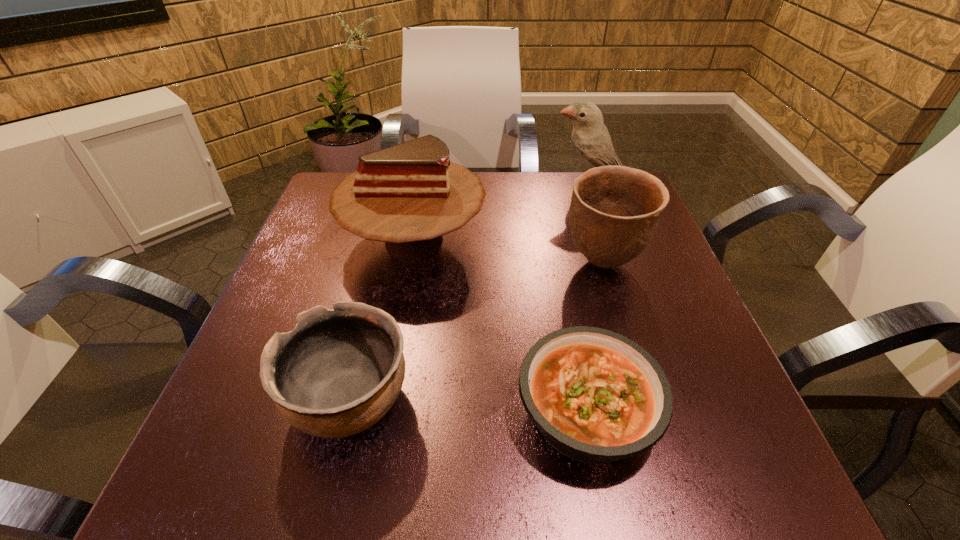
The image size is (960, 540). I want to click on the farthest object, so [591, 141].

At what (x,y) coordinates should I click in order to perform the action: click on cake. Please return your answer as a coordinate pair (x, y). The width and height of the screenshot is (960, 540). Looking at the image, I should click on (408, 195).

I want to click on the farther pottery, so click(x=614, y=212).

Find the location of a particular element. The width and height of the screenshot is (960, 540). the taller pottery is located at coordinates (614, 212).

Identify the location of the shorter pottery. (339, 371).

Find the location of a particular element. The image size is (960, 540). the nearer pottery is located at coordinates (339, 371).

Identify the location of the shortest object. This screenshot has width=960, height=540. (596, 396).

The height and width of the screenshot is (540, 960). I want to click on vacant space positioned at the face of the bird, so click(432, 185).

This screenshot has height=540, width=960. I want to click on free space located at the face of the bird, so click(x=428, y=185).

You are a GUI agent. You are given a task and a screenshot of the screen. Output one action in this format:
    pyautogui.click(x=<x>, y=<y>)
    Task: Click on the vacant space located at the face of the bird
    The height and width of the screenshot is (540, 960).
    Given the screenshot: What is the action you would take?
    pyautogui.click(x=444, y=185)